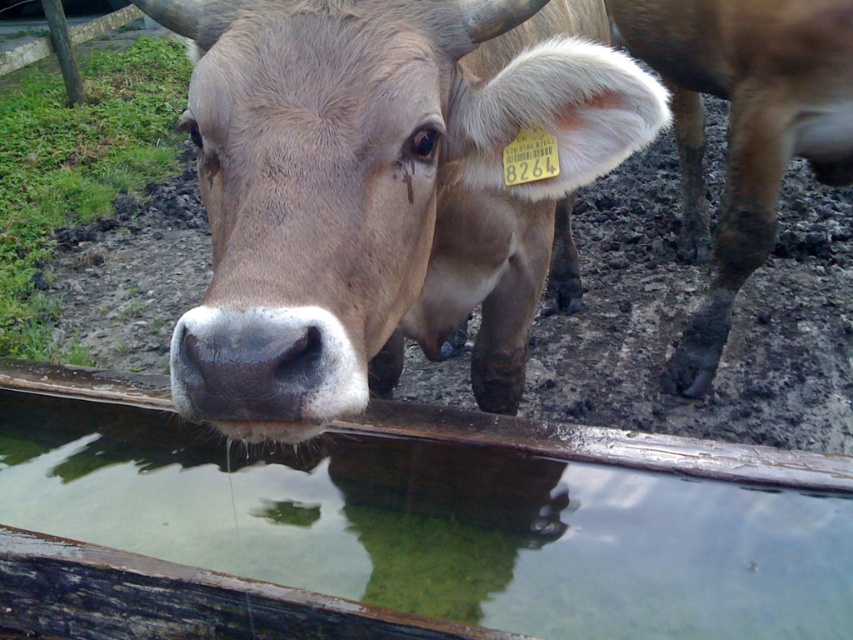
Is point (305, 163) farther from viewer compared to point (772, 70)?

No, (305, 163) is closer to viewer.

Which of these two, brown matte cow at center or brown muddy leg at lower right, stands taller?

With more height is brown muddy leg at lower right.

Who is more distant from viewer, (x=624, y=118) or (x=625, y=19)?

Positioned behind is point (x=625, y=19).

Where is `brown matte cow at center`? This screenshot has height=640, width=853. brown matte cow at center is located at coordinates (380, 189).

What do you see at coordinates (383, 534) in the screenshot?
I see `clear water at center` at bounding box center [383, 534].

Can you confirm if clear water at center is smaller than brown matte cow at center?

Correct, clear water at center occupies less space than brown matte cow at center.

Identify the location of clear water at center. (383, 534).

Identify the location of clear water at center. This screenshot has width=853, height=640. (383, 534).

Is point (386, 588) less distant than point (843, 77)?

Yes, it is in front of point (843, 77).

Which is below, clear water at center or brown muddy leg at lower right?

clear water at center

Describe the element at coordinates (383, 534) in the screenshot. The image size is (853, 640). I see `clear water at center` at that location.

In order to click on clear water at center in this screenshot , I will do `click(383, 534)`.